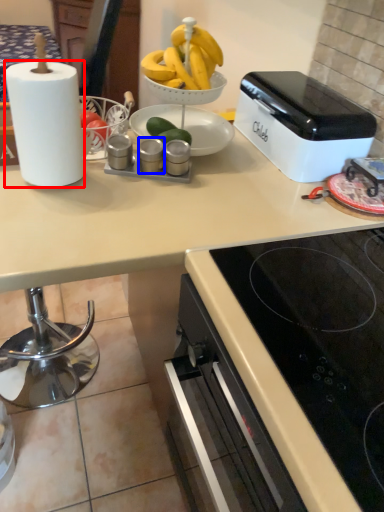
Question: Which of the following is the farthest to the observer, paper towel (highlighted by a red box) or appliance (highlighted by a blue box)?

Choices:
 (A) paper towel
 (B) appliance

Answer: (B)